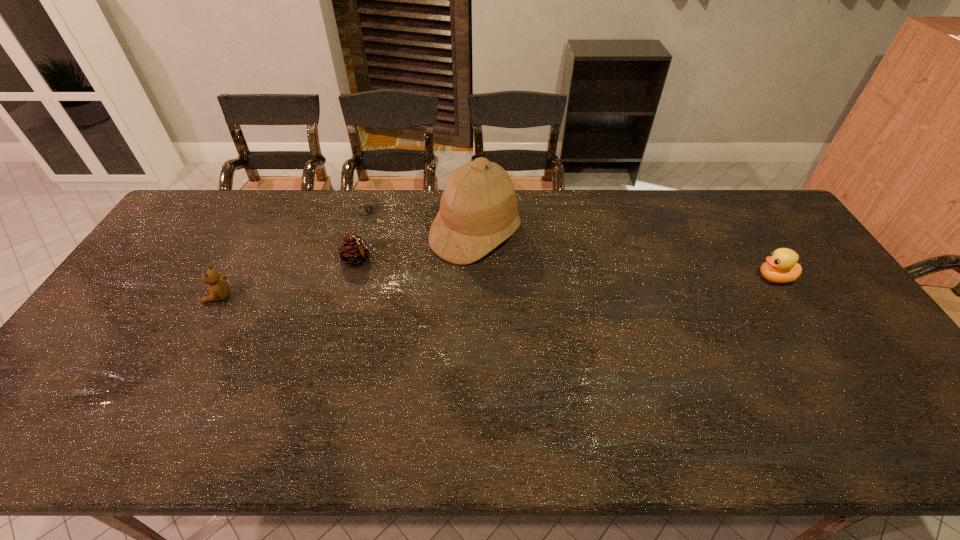
Locate an element on the screen. vacant space situated on the face of the duckling is located at coordinates (699, 278).

Image resolution: width=960 pixels, height=540 pixels. I want to click on vacant space located 0.220m on the face of the duckling, so click(x=682, y=278).

Find the location of `free region located 0.070m with a leaf charm attached to the pinecone`. free region located 0.070m with a leaf charm attached to the pinecone is located at coordinates (391, 273).

Locate an element on the screen. The width and height of the screenshot is (960, 540). vacant space located with a leaf charm attached to the pinecone is located at coordinates (481, 318).

At what (x,y) coordinates should I click in order to perform the action: click on free spot located 0.120m with a leaf charm attached to the pinecone. Please return your answer as a coordinate pair (x, y). Looking at the image, I should click on (404, 280).

The image size is (960, 540). Identify the location of vacant space located 0.300m on the face of the watch. (417, 267).

In order to click on free space located on the face of the watch in this screenshot , I will do `click(385, 230)`.

What are the coordinates of `free space located on the face of the watch` in the screenshot? It's located at (425, 277).

Identify the location of vacant space situated on the front-facing side of the hat. (530, 264).

Where is `vacant space situated on the front-facing side of the hat`? vacant space situated on the front-facing side of the hat is located at coordinates coord(568,285).